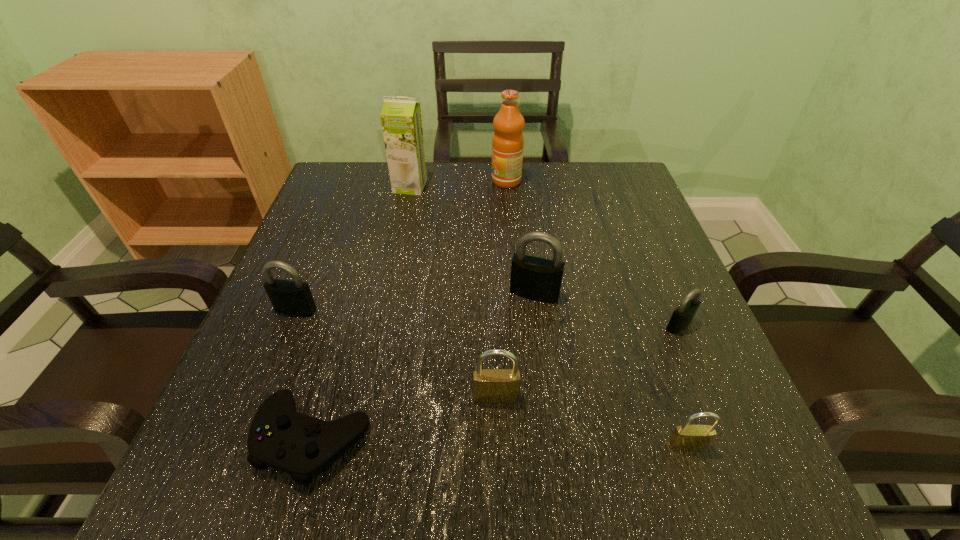
Identify the location of free location located on the back of the fourth nearest object. (664, 289).

At what (x,y) coordinates should I click in order to perform the action: click on vacant space located 0.280m on the right of the control. Please return your answer as a coordinate pair (x, y). This screenshot has width=960, height=540. Looking at the image, I should click on click(x=559, y=438).

What are the coordinates of `soya milk that is at the far edge` in the screenshot? It's located at (401, 121).

This screenshot has width=960, height=540. Identify the location of fruit juice positioned at the far edge. (508, 142).

Locate an element on the screen. Image resolution: width=960 pixels, height=540 pixels. padlock located in the near edge section of the desktop is located at coordinates (685, 437).

The image size is (960, 540). Identify the location of control situated at the near edge. (280, 437).

At what (x,y) coordinates should I click in order to perform the action: click on padlock that is at the left edge. Please return your answer as a coordinate pair (x, y). The image size is (960, 540). Looking at the image, I should click on (294, 297).

Where is `control that is positioned at the left edge`? control that is positioned at the left edge is located at coordinates point(280,437).

Identify the location of object located in the near left corner section of the desktop. (280, 437).

This screenshot has height=540, width=960. I want to click on object that is at the near right corner, so click(x=685, y=437).